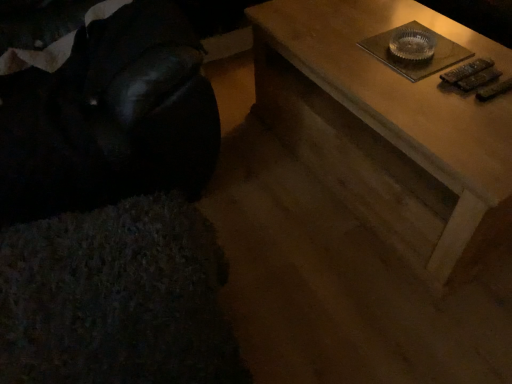
Question: Considering the relative sizes of velvet black bean bag chair at left and wooden table at upper right in the image provided, is velvet black bean bag chair at left shorter than wooden table at upper right?

Choices:
 (A) yes
 (B) no

Answer: (B)

Question: From the image's perspective, is velvet black bean bag chair at left located beneath wooden table at upper right?

Choices:
 (A) no
 (B) yes

Answer: (A)

Question: Is velvet black bean bag chair at left behind wooden table at upper right?

Choices:
 (A) yes
 (B) no

Answer: (B)

Question: Is velvet black bean bag chair at left at the left side of wooden table at upper right?

Choices:
 (A) yes
 (B) no

Answer: (A)

Question: Is velvet black bean bag chair at left to the right of wooden table at upper right from the viewer's perspective?

Choices:
 (A) no
 (B) yes

Answer: (A)

Question: From the image's perspective, does velvet black bean bag chair at left appear higher than wooden table at upper right?

Choices:
 (A) no
 (B) yes

Answer: (B)

Question: Considering the relative sizes of wooden table at upper right and velvet black bean bag chair at left in the image provided, is wooden table at upper right bigger than velvet black bean bag chair at left?

Choices:
 (A) yes
 (B) no

Answer: (B)

Question: Is wooden table at upper right shorter than velvet black bean bag chair at left?

Choices:
 (A) yes
 (B) no

Answer: (A)

Question: Is wooden table at upper right closer to camera compared to velvet black bean bag chair at left?

Choices:
 (A) yes
 (B) no

Answer: (B)

Question: Is wooden table at upper right facing towards velvet black bean bag chair at left?

Choices:
 (A) no
 (B) yes

Answer: (A)

Question: Can you confirm if wooden table at upper right is wider than velvet black bean bag chair at left?

Choices:
 (A) no
 (B) yes

Answer: (B)

Question: Is wooden table at upper right oriented away from velvet black bean bag chair at left?

Choices:
 (A) no
 (B) yes

Answer: (A)

Question: Is velvet black bean bag chair at left inside or outside of wooden table at upper right?

Choices:
 (A) inside
 (B) outside

Answer: (B)